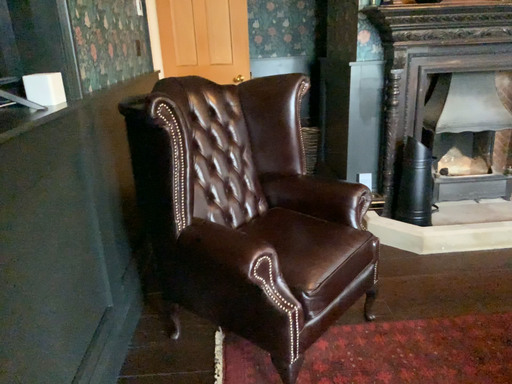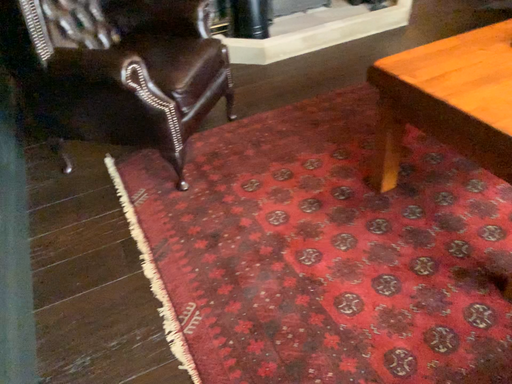
Question: Which way did the camera rotate in the video?

Choices:
 (A) rotated left
 (B) rotated right

Answer: (B)